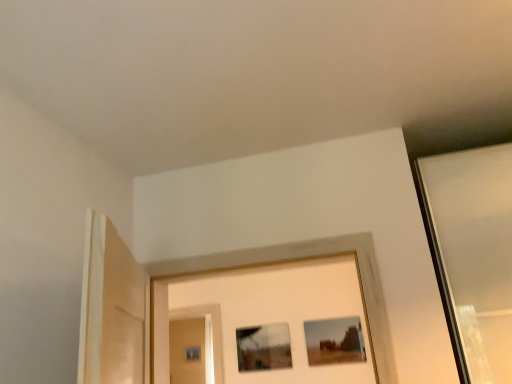
Question: From a real-world perspective, is matte glass picture frame at center, which appears as the 2th picture frame when viewed from the right, physically located above or below matte brown picture frame at center, which is counted as the 2th picture frame, starting from the left?

Choices:
 (A) below
 (B) above

Answer: (A)

Question: Is matte glass picture frame at center, which is counted as the 1th picture frame, starting from the left, in front of or behind matte brown picture frame at center, which is counted as the 2th picture frame, starting from the left, in the image?

Choices:
 (A) front
 (B) behind

Answer: (B)

Question: Estimate the real-world distances between objects in this image. Which object is closer to the matte brown picture frame at center, which is counted as the 2th picture frame, starting from the left?

Choices:
 (A) matte glass screen door at center
 (B) matte glass picture frame at center, which appears as the 2th picture frame when viewed from the right

Answer: (B)

Question: Considering the real-world distances, which object is farthest from the matte glass screen door at center?

Choices:
 (A) matte glass picture frame at center, which appears as the 2th picture frame when viewed from the right
 (B) matte brown picture frame at center, the 1th picture frame from the right

Answer: (B)